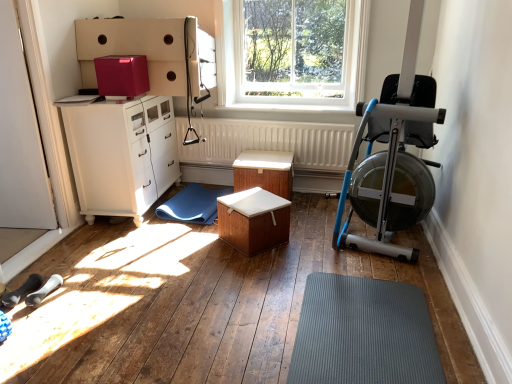
Question: From the image's perspective, is wooden table at center, which is the first table from back to front, over blue rubber mat at center, acting as the first doormat starting from the left?

Choices:
 (A) yes
 (B) no

Answer: (A)

Question: From a real-world perspective, is wooden table at center, which is the first table from back to front, physically below blue rubber mat at center, acting as the first doormat starting from the left?

Choices:
 (A) no
 (B) yes

Answer: (A)

Question: Can you confirm if wooden table at center, the 2th table positioned from the front, is shorter than blue rubber mat at center, which is the first doormat in top-to-bottom order?

Choices:
 (A) no
 (B) yes

Answer: (A)

Question: Can you confirm if wooden table at center, which is the first table from back to front, is bigger than blue rubber mat at center, the 2th doormat viewed from the right?

Choices:
 (A) no
 (B) yes

Answer: (B)

Question: Can you confirm if wooden table at center, which is the first table from back to front, is positioned to the right of blue rubber mat at center, marked as the 1th doormat in a back-to-front arrangement?

Choices:
 (A) yes
 (B) no

Answer: (A)

Question: Is wooden table at center, the 2th table positioned from the front, at the left side of blue rubber mat at center, acting as the first doormat starting from the left?

Choices:
 (A) no
 (B) yes

Answer: (A)

Question: Does gray rubber mat at lower center, the first doormat positioned from the front, touch wooden table at center, the 2th table positioned from the front?

Choices:
 (A) no
 (B) yes

Answer: (A)

Question: Considering the relative sizes of gray rubber mat at lower center, arranged as the second doormat when viewed from the back, and wooden table at center, the 2th table positioned from the front, in the image provided, is gray rubber mat at lower center, arranged as the second doormat when viewed from the back, taller than wooden table at center, the 2th table positioned from the front,?

Choices:
 (A) no
 (B) yes

Answer: (A)

Question: Would you say wooden table at center, the 2th table positioned from the front, is part of gray rubber mat at lower center, the first doormat positioned from the front,'s contents?

Choices:
 (A) yes
 (B) no

Answer: (B)

Question: Is gray rubber mat at lower center, acting as the first doormat starting from the bottom, shorter than wooden table at center, the 2th table positioned from the front?

Choices:
 (A) no
 (B) yes

Answer: (B)

Question: Is gray rubber mat at lower center, the 2th doormat from the left, positioned before wooden table at center, the 2th table positioned from the front?

Choices:
 (A) yes
 (B) no

Answer: (A)

Question: From a real-world perspective, is gray rubber mat at lower center, arranged as the second doormat when viewed from the back, positioned under wooden table at center, the 2th table positioned from the front, based on gravity?

Choices:
 (A) no
 (B) yes

Answer: (B)

Question: Does glossy cardboard box at upper center have a larger size compared to gray rubber mat at lower center, acting as the first doormat starting from the bottom?

Choices:
 (A) no
 (B) yes

Answer: (A)